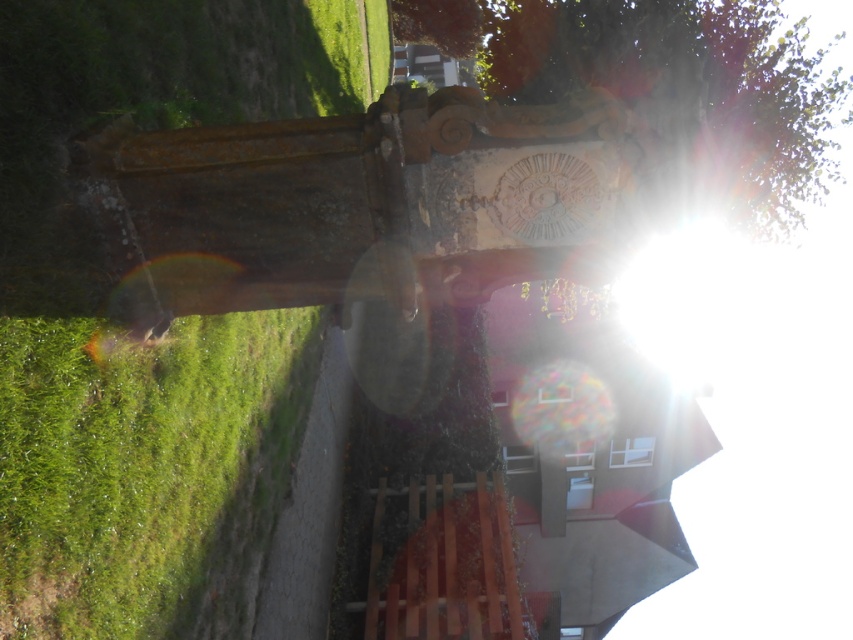
You are planning to place a small garden statue that requires a 1 meter by 1 meter space. Given the green grass at lower left and the green leafy tree at upper center, which area would be suitable for placing the statue?

The green grass at lower left is smaller than the green leafy tree at upper center, so the green grass at lower left is more suitable for placing the statue since it requires a 1 meter by 1 meter space.

Consider the image. You are a gardener planning to mow the green grass at lower left and the green leafy tree at upper center. Which area requires a wider mower path? Please explain based on their widths.

The green leafy tree at upper center requires a wider mower path because its width is greater than the green grass at lower left.

You are standing on the paved pathway leading to the stone structure. You want to take a photo of the green leafy tree at upper center without the green grass at lower left appearing in the frame. Which direction should you move to achieve this?

Move to the right so that the green grass at lower left is no longer in the frame with the green leafy tree at upper center.